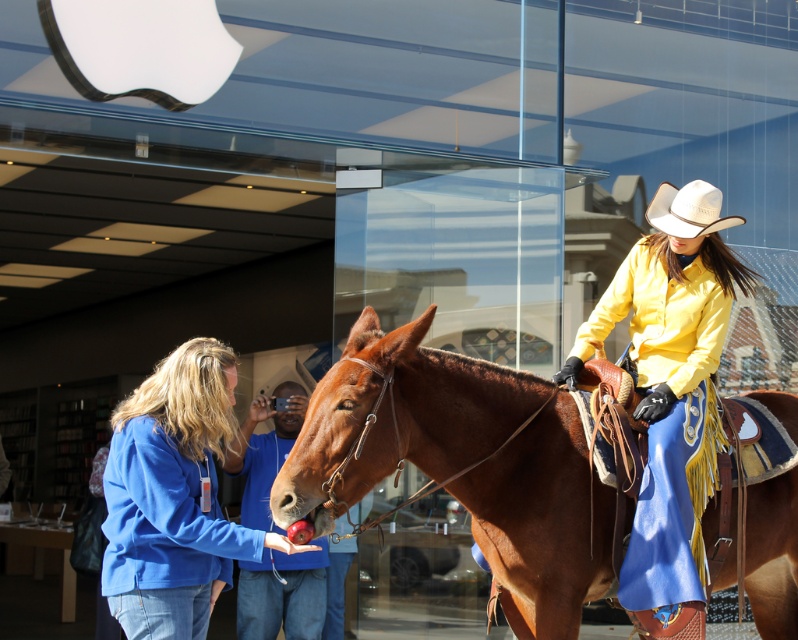
Is point (504, 529) closer to camera compared to point (105, 524)?

No, (504, 529) is further to viewer.

Can you confirm if brown leather horse at center is wider than blue cotton jacket at center?

Yes.

Describe the element at coordinates (399, 417) in the screenshot. I see `brown leather horse at center` at that location.

Find the location of a particular element. brown leather horse at center is located at coordinates (399, 417).

Does blue cotton jacket at center have a greater height compared to white felt cowboy hat at upper right?

Indeed, blue cotton jacket at center has a greater height compared to white felt cowboy hat at upper right.

Which is behind, point (125, 541) or point (702, 230)?

Positioned behind is point (702, 230).

Identify the location of blue cotton jacket at center. This screenshot has width=798, height=640. (174, 497).

Is brown leather horse at center thinner than white felt cowboy hat at upper right?

No.

Which is in front, point (346, 433) or point (702, 202)?

Point (346, 433) is in front.

Identify the location of brown leather horse at center. (399, 417).